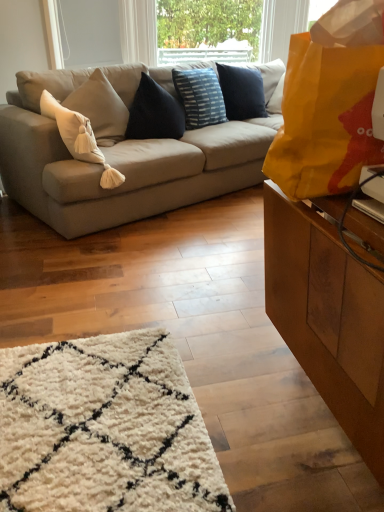
Question: Should I look upward or downward to see beige fabric couch at center?

Choices:
 (A) down
 (B) up

Answer: (B)

Question: From the image's perspective, is white soft cushion at left, positioned as the 2th pillow in right-to-left order, below yellow paper bag at right?

Choices:
 (A) yes
 (B) no

Answer: (B)

Question: Is white soft cushion at left, acting as the second pillow starting from the back, behind yellow paper bag at right?

Choices:
 (A) no
 (B) yes

Answer: (B)

Question: Does white soft cushion at left, the first pillow viewed from the front, have a greater height compared to yellow paper bag at right?

Choices:
 (A) no
 (B) yes

Answer: (B)

Question: Is white soft cushion at left, acting as the second pillow starting from the back, in contact with yellow paper bag at right?

Choices:
 (A) yes
 (B) no

Answer: (B)

Question: Is white soft cushion at left, the first pillow viewed from the front, turned away from yellow paper bag at right?

Choices:
 (A) yes
 (B) no

Answer: (B)

Question: Is the depth of white soft cushion at left, acting as the second pillow starting from the back, less than that of yellow paper bag at right?

Choices:
 (A) yes
 (B) no

Answer: (B)

Question: Is blue striped cushion at center, positioned as the 1th pillow in back-to-front order, bigger than beige fabric couch at center?

Choices:
 (A) yes
 (B) no

Answer: (B)

Question: Is blue striped cushion at center, arranged as the second pillow when viewed from the front, positioned with its back to beige fabric couch at center?

Choices:
 (A) yes
 (B) no

Answer: (A)

Question: Is blue striped cushion at center, the 1th pillow positioned from the right, not near beige fabric couch at center?

Choices:
 (A) yes
 (B) no

Answer: (B)

Question: Is blue striped cushion at center, the 1th pillow positioned from the right, oriented towards beige fabric couch at center?

Choices:
 (A) yes
 (B) no

Answer: (A)

Question: From the image's perspective, is blue striped cushion at center, which is the 2th pillow from left to right, on beige fabric couch at center?

Choices:
 (A) yes
 (B) no

Answer: (A)

Question: Is blue striped cushion at center, which is the 2th pillow from left to right, wider than beige fabric couch at center?

Choices:
 (A) no
 (B) yes

Answer: (A)

Question: From a real-world perspective, is yellow paper bag at right physically below white soft cushion at left, acting as the second pillow starting from the back?

Choices:
 (A) no
 (B) yes

Answer: (A)